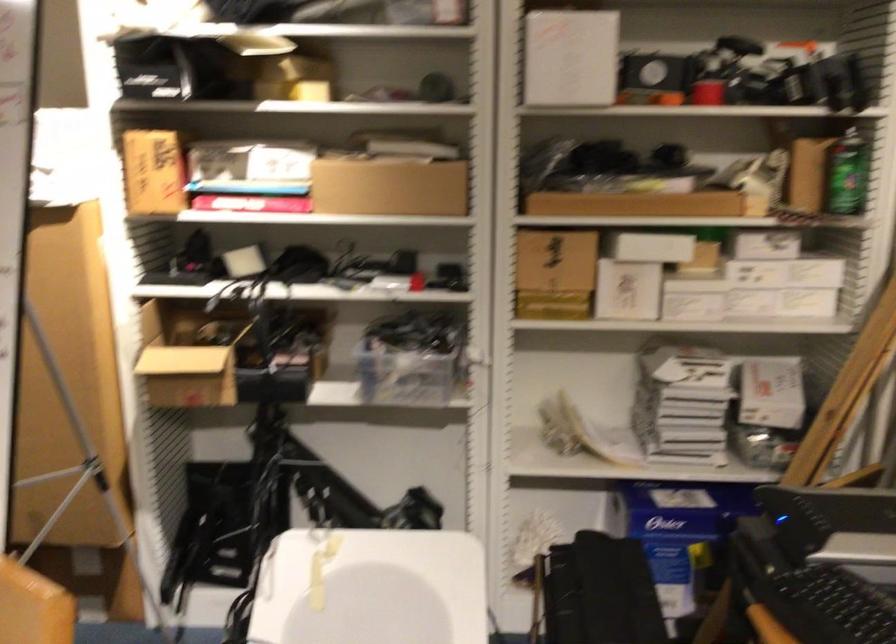
You are a GUI agent. You are given a task and a screenshot of the screen. Output one action in this format:
    pyautogui.click(x=<x>, y=<y>)
    Task: Click on the white rectangular box
    
    Given the screenshot: What is the action you would take?
    pyautogui.click(x=570, y=58)